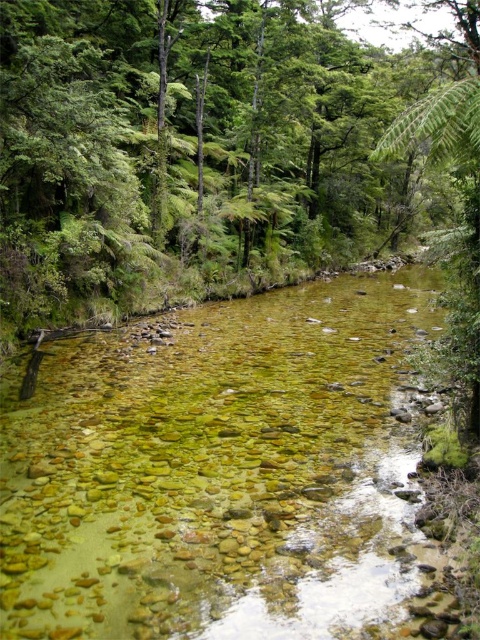
You are a geologist studying the stream in the image. You need to locate the translucent rock bed at center. What are the coordinates where you should focus your analysis?

The coordinates for the translucent rock bed at center are at point (215, 468).

You are standing at the edge of the stream and want to cross to the other side. The translucent rock bed at center and the green leafy tree at center are in your path. Which object should you avoid stepping on to cross safely?

You should avoid stepping on the translucent rock bed at center because it is positioned on the left side of the green leafy tree at center, meaning it is part of the stream bed and not solid ground.